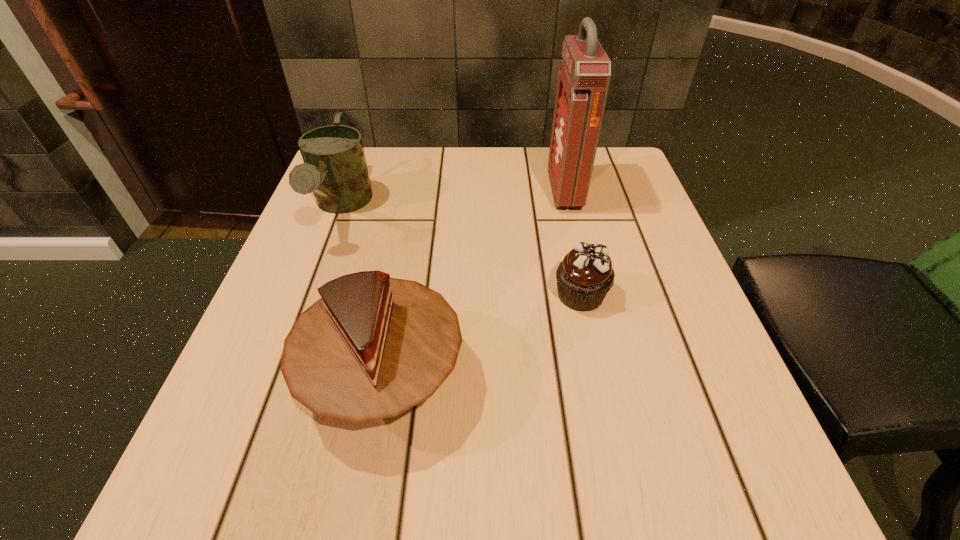
At what (x,y) coordinates should I click in order to perform the action: click on the first-aid kit that is at the far edge. Please return your answer as a coordinate pair (x, y). Looking at the image, I should click on click(x=584, y=77).

This screenshot has height=540, width=960. Find the location of `watering can situated at the far edge`. watering can situated at the far edge is located at coordinates (335, 169).

Image resolution: width=960 pixels, height=540 pixels. In order to click on object that is at the near edge in this screenshot , I will do `click(372, 347)`.

You are a GUI agent. You are given a task and a screenshot of the screen. Output one action in this format:
    pyautogui.click(x=<x>, y=<y>)
    Task: Click on the watering can that is at the left edge
    This screenshot has width=960, height=540.
    Given the screenshot: What is the action you would take?
    pyautogui.click(x=335, y=169)

The width and height of the screenshot is (960, 540). I want to click on cake at the left edge, so click(372, 347).

Where is `the first-aid kit situated at the right edge`? This screenshot has width=960, height=540. the first-aid kit situated at the right edge is located at coordinates (584, 77).

I want to click on cupcake at the right edge, so click(584, 277).

Where is `object positioned at the far left corner`? This screenshot has height=540, width=960. object positioned at the far left corner is located at coordinates (335, 169).

Identify the location of object present at the near left corner. This screenshot has width=960, height=540. (372, 347).

Where is `object present at the far right corner`? object present at the far right corner is located at coordinates (584, 77).